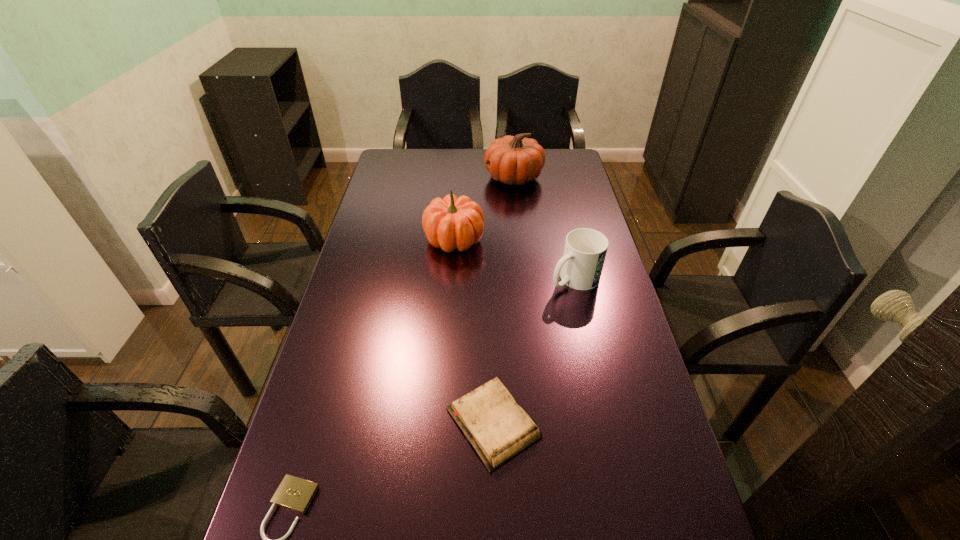
Locate an element on the screen. the farther pumpkin is located at coordinates (514, 160).

The height and width of the screenshot is (540, 960). Identify the location of the farthest object. 514,160.

I want to click on the nearer pumpkin, so click(x=449, y=223).

The height and width of the screenshot is (540, 960). What are the coordinates of `the second farthest object` in the screenshot? It's located at (449, 223).

Locate an element on the screen. Image resolution: width=960 pixels, height=540 pixels. mug is located at coordinates (585, 250).

Locate an element on the screen. This screenshot has width=960, height=540. the third shortest object is located at coordinates (585, 250).

Identify the location of the fourth farthest object. The image size is (960, 540). (498, 429).

Image resolution: width=960 pixels, height=540 pixels. I want to click on the fourth tallest object, so click(x=498, y=429).

Image resolution: width=960 pixels, height=540 pixels. In order to click on vacant space located 0.130m on the face of the farther pumpkin in this screenshot , I will do `click(452, 177)`.

The width and height of the screenshot is (960, 540). I want to click on vacant space located on the face of the farther pumpkin, so click(x=440, y=177).